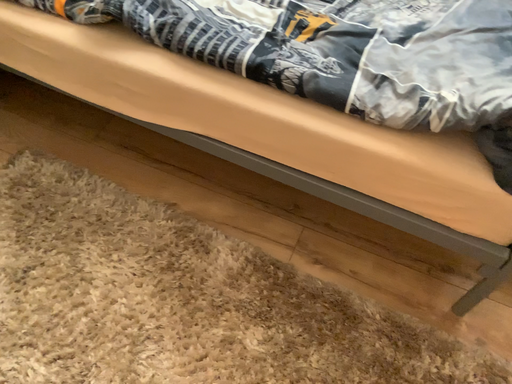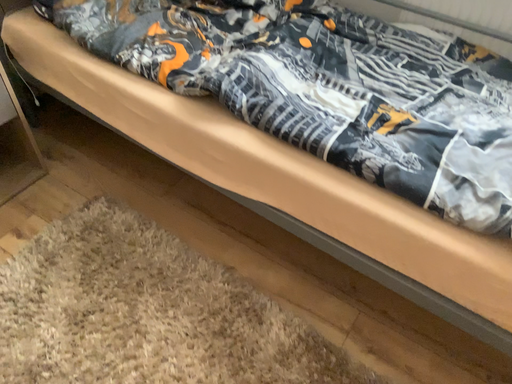
Question: Which way did the camera rotate in the video?

Choices:
 (A) rotated upward
 (B) rotated downward

Answer: (A)